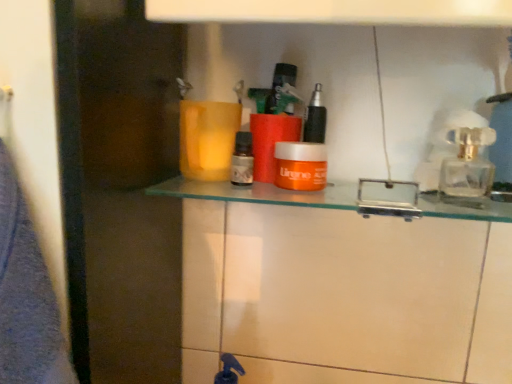
Question: Is orange plastic container at center smaller than orange matte jar at center?

Choices:
 (A) no
 (B) yes

Answer: (A)

Question: From a real-world perspective, is orange plastic container at center positioned under orange matte jar at center based on gravity?

Choices:
 (A) yes
 (B) no

Answer: (A)

Question: Could orange matte jar at center be considered to be inside orange plastic container at center?

Choices:
 (A) yes
 (B) no

Answer: (B)

Question: Considering the relative sizes of orange plastic container at center and orange matte jar at center in the image provided, is orange plastic container at center thinner than orange matte jar at center?

Choices:
 (A) yes
 (B) no

Answer: (B)

Question: From a real-world perspective, is orange plastic container at center positioned over orange matte jar at center based on gravity?

Choices:
 (A) yes
 (B) no

Answer: (B)

Question: Is transparent glass perfume bottle at upper right wider or thinner than orange plastic container at center?

Choices:
 (A) thin
 (B) wide

Answer: (A)

Question: From a real-world perspective, is transparent glass perfume bottle at upper right physically located above or below orange plastic container at center?

Choices:
 (A) below
 (B) above

Answer: (B)

Question: Considering the positions of point (480, 175) and point (197, 185), is point (480, 175) closer or farther from the camera than point (197, 185)?

Choices:
 (A) farther
 (B) closer

Answer: (B)

Question: Is transparent glass perfume bottle at upper right to the left or to the right of orange plastic container at center in the image?

Choices:
 (A) right
 (B) left

Answer: (A)

Question: Considering the positions of orange matte jar at center, the 1th toiletry in the right-to-left sequence, and transparent glass door at left in the image, is orange matte jar at center, the 1th toiletry in the right-to-left sequence, wider or thinner than transparent glass door at left?

Choices:
 (A) thin
 (B) wide

Answer: (A)

Question: Relative to transparent glass door at left, is orange matte jar at center, the 1th toiletry in the right-to-left sequence, in front or behind?

Choices:
 (A) behind
 (B) front

Answer: (A)

Question: Looking at the image, does orange matte jar at center, the 1th toiletry in the right-to-left sequence, seem bigger or smaller compared to transparent glass door at left?

Choices:
 (A) small
 (B) big

Answer: (A)

Question: Do you think orange matte jar at center, the second toiletry positioned from the left, is within transparent glass door at left, or outside of it?

Choices:
 (A) inside
 (B) outside

Answer: (B)

Question: Considering the positions of brown glass bottle at center, the second toiletry positioned from the right, and orange plastic container at center in the image, is brown glass bottle at center, the second toiletry positioned from the right, wider or thinner than orange plastic container at center?

Choices:
 (A) thin
 (B) wide

Answer: (A)

Question: Considering the positions of brown glass bottle at center, the second toiletry positioned from the right, and orange plastic container at center in the image, is brown glass bottle at center, the second toiletry positioned from the right, bigger or smaller than orange plastic container at center?

Choices:
 (A) big
 (B) small

Answer: (B)